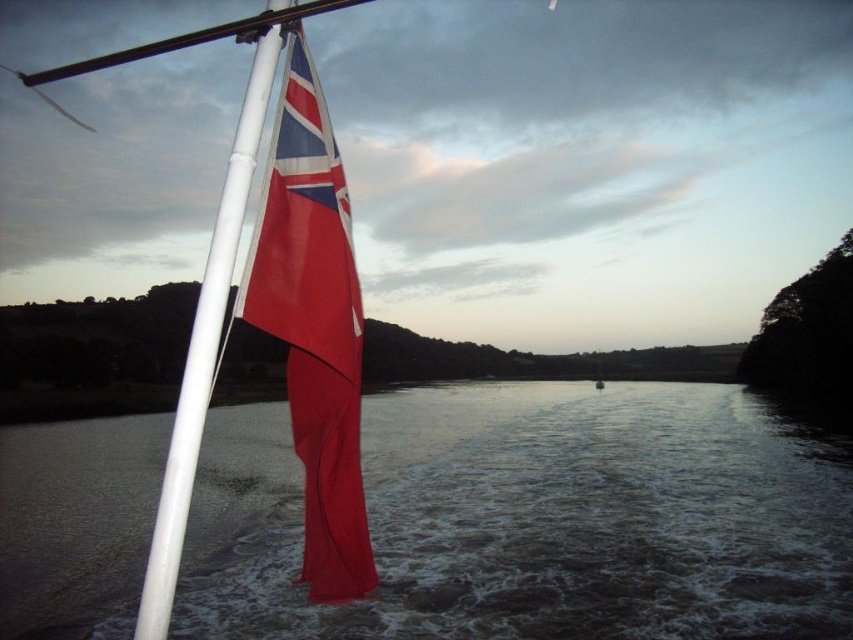
Question: Which point appears farthest from the camera in this image?

Choices:
 (A) (236, 147)
 (B) (300, 248)

Answer: (B)

Question: Is smooth water at lower left above textured fabric flag at left?

Choices:
 (A) no
 (B) yes

Answer: (A)

Question: Which point appears farthest from the camera in this image?

Choices:
 (A) (685, 460)
 (B) (270, 240)
 (C) (169, 580)

Answer: (A)

Question: Does smooth water at lower left appear on the left side of white glossy flag pole at upper left?

Choices:
 (A) no
 (B) yes

Answer: (A)

Question: Is smooth water at lower left thinner than textured fabric flag at left?

Choices:
 (A) yes
 (B) no

Answer: (B)

Question: Which of the following is the farthest from the observer?

Choices:
 (A) white glossy flag pole at upper left
 (B) textured fabric flag at left

Answer: (B)